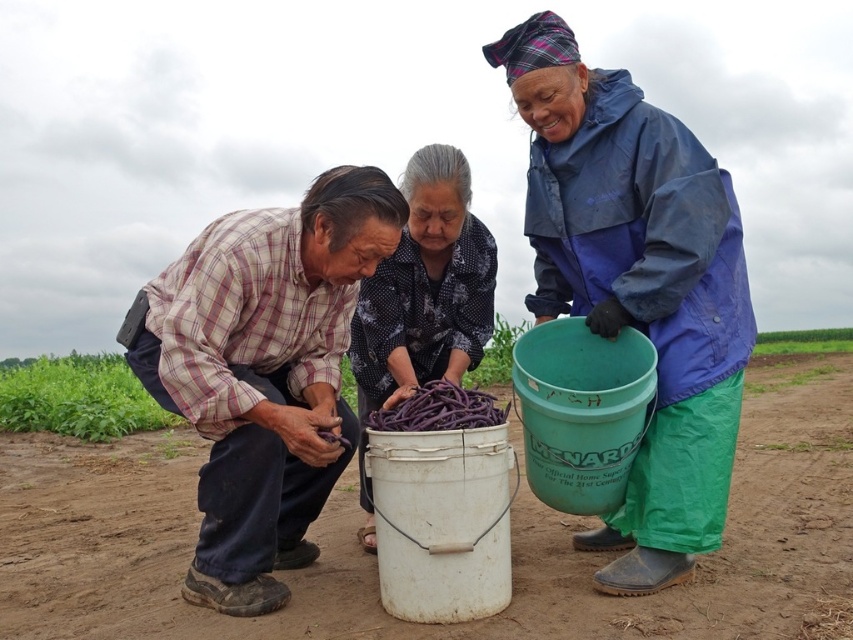
Consider the image. You are a farmer who needs to carry both the plaid shirt at center and the patterned fabric bucket at center. Which item can you carry more easily if you have limited space?

The patterned fabric bucket at center is smaller in size than the plaid shirt at center, so it can be carried more easily with limited space.